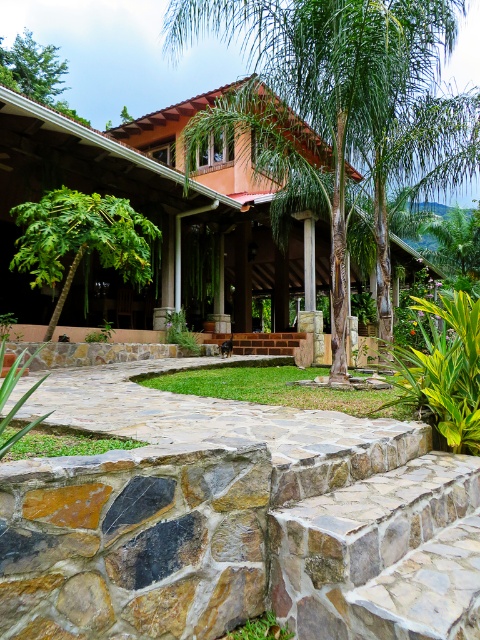
You are standing at the point closest to the front of the image. Which of the two points, point [452,145] or point [127,214], is farther away from you?

Point [452,145] is farther away because it is positioned behind point [127,214].

You are standing in the garden and want to take a photo of the green leafy palm tree at center and the green leafy tree at left. Which tree should you focus on first if you want to capture both in a single frame without moving the camera?

You should focus on the green leafy palm tree at center first because it is closer to the viewer, ensuring it stays in focus while the background tree might naturally blur less if the depth of field allows, but to capture both, adjusting focus between them or using a smaller aperture could help. However, based on their positions, prioritizing the closer palm tree ensures it is sharp.